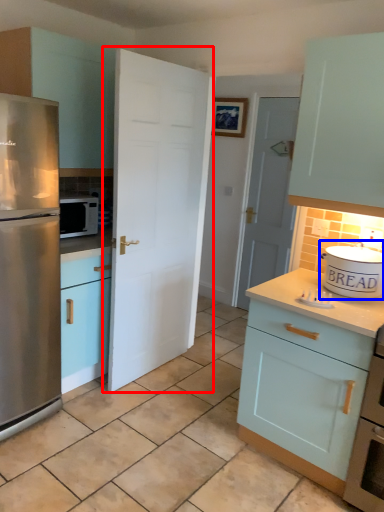
Question: Which point is closer to the camera, door (highlighted by a red box) or appliance (highlighted by a blue box)?

Choices:
 (A) door
 (B) appliance

Answer: (B)